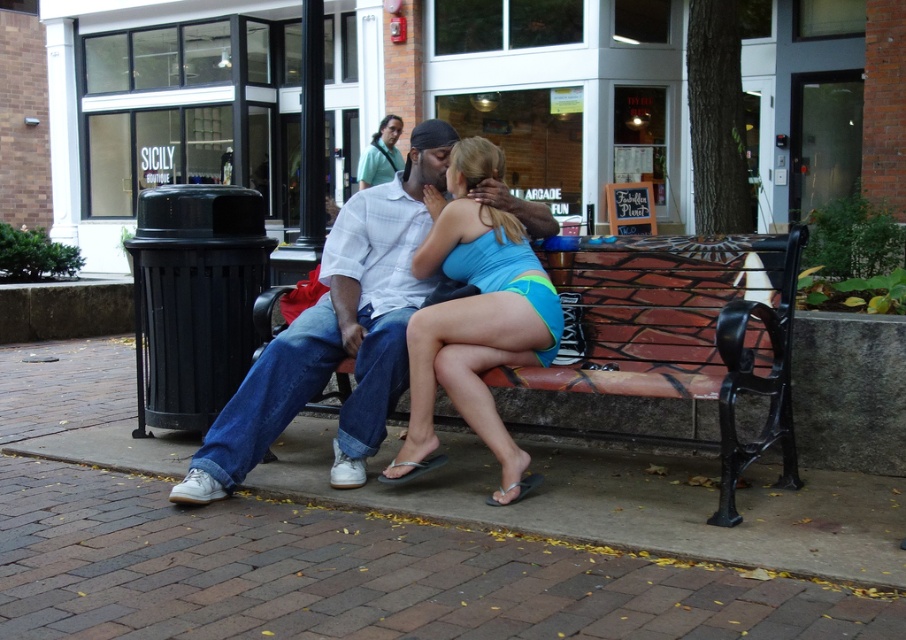
Question: In this image, where is brick-patterned bench at center located relative to blue fabric shorts at center?

Choices:
 (A) left
 (B) right

Answer: (B)

Question: From the image, what is the correct spatial relationship of brick-patterned bench at center in relation to blue fabric shorts at center?

Choices:
 (A) left
 (B) right

Answer: (B)

Question: Considering the real-world distances, which object is closest to the brick-patterned bench at center?

Choices:
 (A) white cotton shirt at center
 (B) blue fabric shorts at center

Answer: (B)

Question: Which point appears closest to the camera in this image?

Choices:
 (A) (643, 324)
 (B) (431, 428)

Answer: (B)

Question: Observing the image, what is the correct spatial positioning of white cotton shirt at center in reference to blue fabric shorts at center?

Choices:
 (A) below
 (B) above

Answer: (A)

Question: Which object is closer to the camera taking this photo?

Choices:
 (A) brick-patterned bench at center
 (B) white cotton shirt at center
 (C) blue fabric shorts at center

Answer: (A)